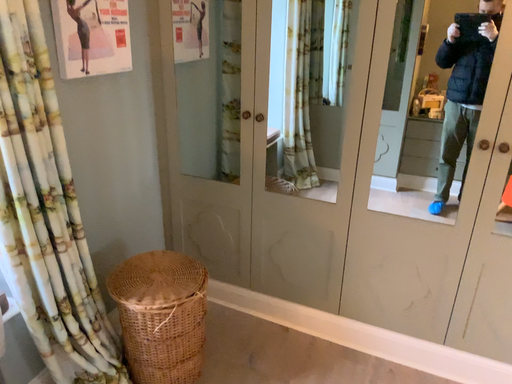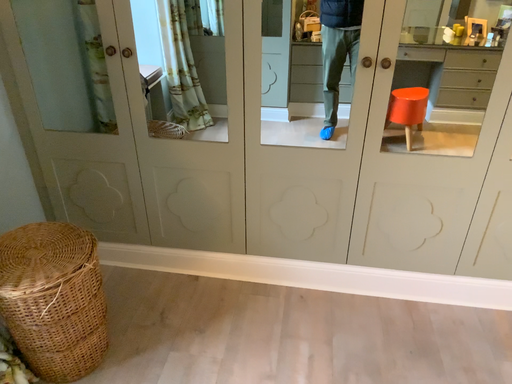
Question: How did the camera likely rotate when shooting the video?

Choices:
 (A) rotated right
 (B) rotated left

Answer: (A)